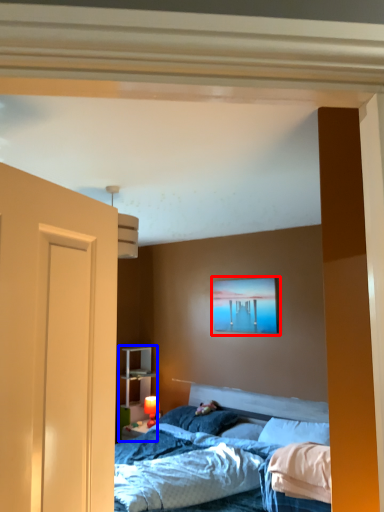
Question: Among these objects, which one is farthest to the camera, picture frame (highlighted by a red box) or dresser (highlighted by a blue box)?

Choices:
 (A) picture frame
 (B) dresser

Answer: (B)